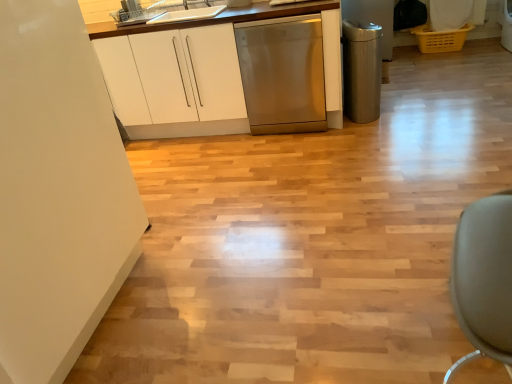
Find the location of `empty space that is to the right of polished stainless steel trash can at right, which appears as the 2th appliance when viewed from the top`. empty space that is to the right of polished stainless steel trash can at right, which appears as the 2th appliance when viewed from the top is located at coordinates (411, 112).